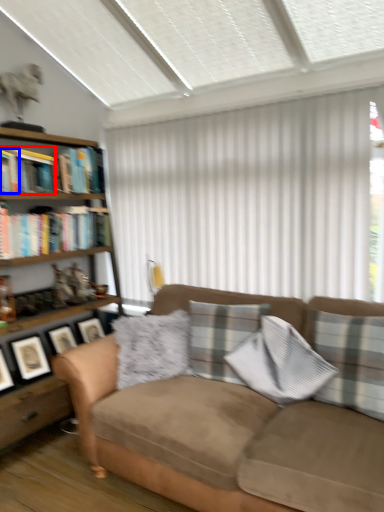
Question: Among these objects, which one is farthest to the camera, book (highlighted by a red box) or book (highlighted by a blue box)?

Choices:
 (A) book
 (B) book

Answer: (A)